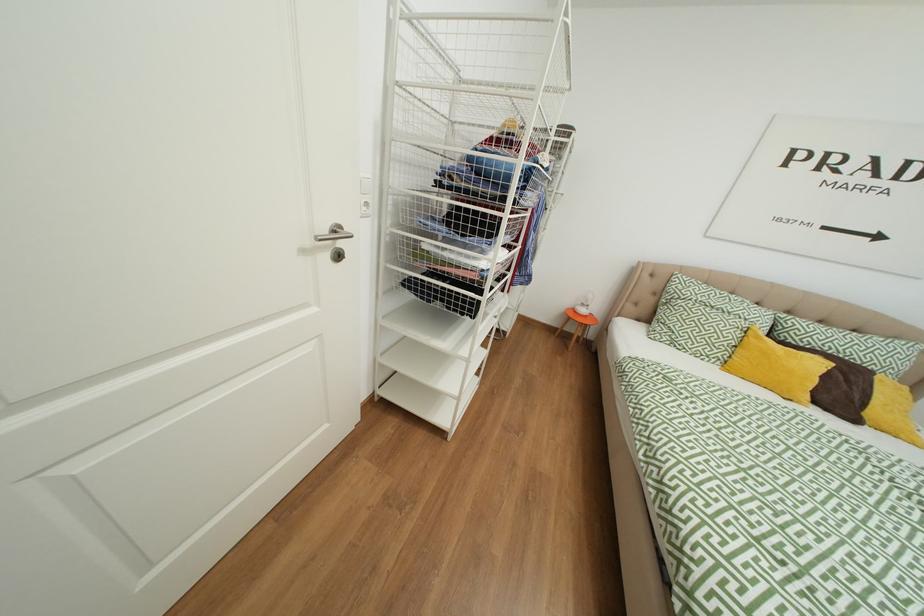
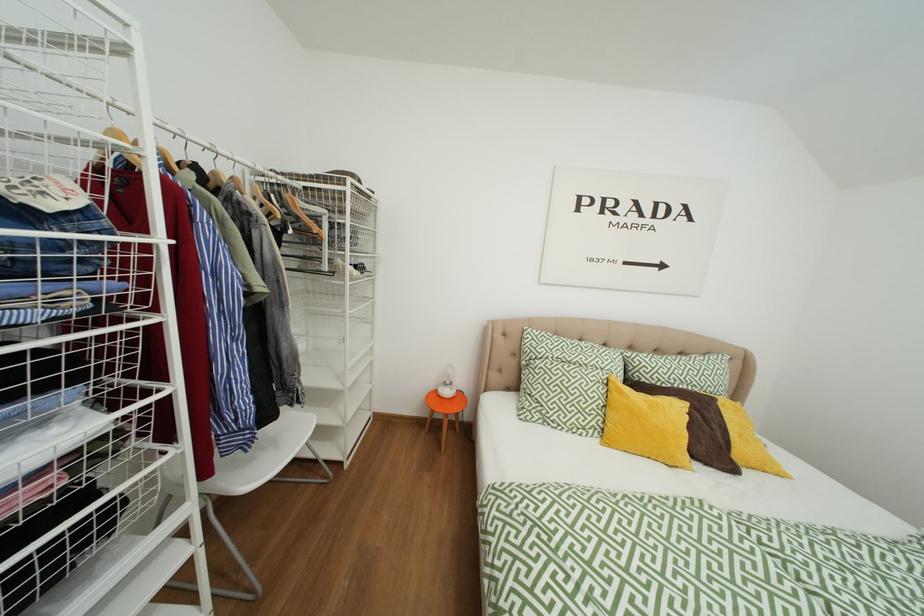
In a continuous first-person perspective shot, in which direction is the camera moving?

The movement direction of the cameraman is right, forward.